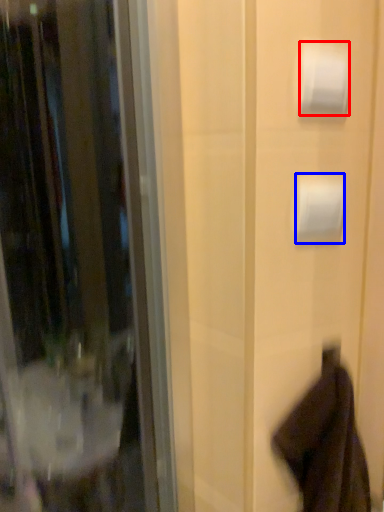
Question: Which point is closer to the camera, toilet paper (highlighted by a red box) or toilet paper (highlighted by a blue box)?

Choices:
 (A) toilet paper
 (B) toilet paper

Answer: (A)